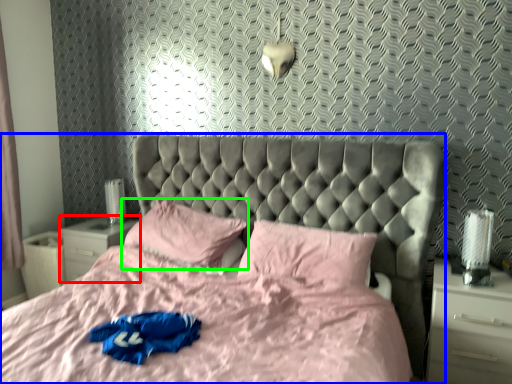
Question: Which object is positioned closest to nightstand (highlighted by a red box)? Select from bed (highlighted by a blue box) and pillow (highlighted by a green box).

Choices:
 (A) bed
 (B) pillow

Answer: (B)